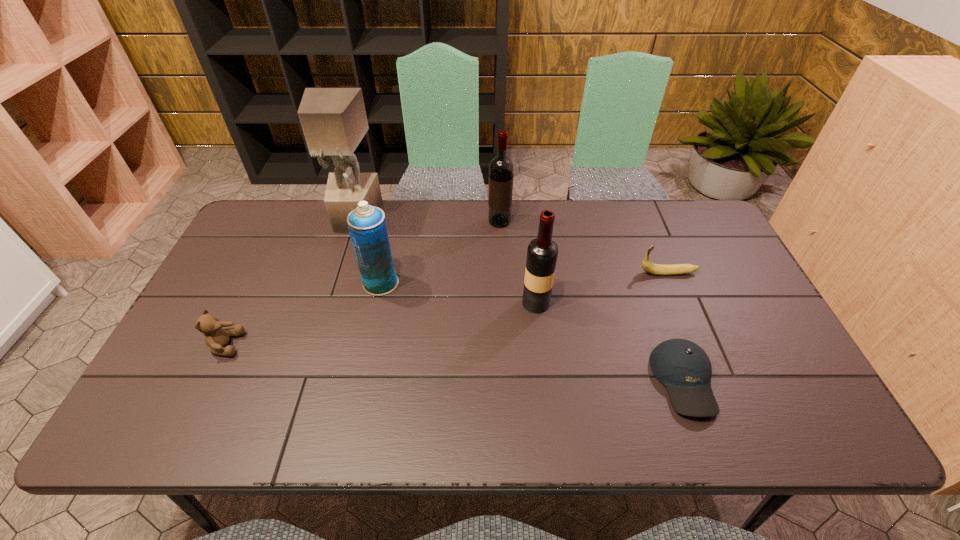
The width and height of the screenshot is (960, 540). I want to click on empty location between the shortest object and the tallest object, so click(519, 299).

Where is `vacant space that's between the fourth object from right to left and the tallest object`? Image resolution: width=960 pixels, height=540 pixels. vacant space that's between the fourth object from right to left and the tallest object is located at coordinates (427, 220).

At what (x,y) coordinates should I click in order to perform the action: click on vacant space that's between the banana and the nearer wine bottle. Please return your answer as a coordinate pair (x, y). The image size is (960, 540). Looking at the image, I should click on [x=602, y=288].

The width and height of the screenshot is (960, 540). I want to click on free area in between the teddy bear and the baseball cap, so click(x=455, y=363).

This screenshot has height=540, width=960. Identify the location of free space that is in between the shortest object and the fourth object from right to left. pos(591,301).

Identify the location of free space between the sculpture and the banana. The width and height of the screenshot is (960, 540). (512, 246).

Find the location of a particular element. free space that is in between the leftmost object and the banana is located at coordinates (446, 309).

This screenshot has height=540, width=960. Find the location of `free space between the banana and the left wine bottle`. free space between the banana and the left wine bottle is located at coordinates (584, 247).

You are a GUI agent. You are given a task and a screenshot of the screen. Output one action in this format:
    pyautogui.click(x=<x>, y=<y>)
    Task: Click on the second closest object to the baseball cap
    This screenshot has height=540, width=960.
    Given the screenshot: What is the action you would take?
    pyautogui.click(x=542, y=253)

Identify which object is the nearest to the banana. Please provide its 2D coordinates. Your answer should be formatted as a tuple, i.e. [(x, y)], where the tuple contains the x and y coordinates of a point satisfying the conditions above.

[(684, 368)]